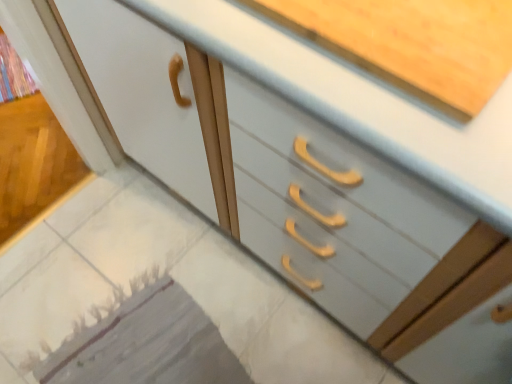
Question: Is white glossy countertop at upper center at the back of white glossy tile at lower left?

Choices:
 (A) yes
 (B) no

Answer: (B)

Question: Is white glossy countertop at upper center inside white glossy tile at lower left?

Choices:
 (A) yes
 (B) no

Answer: (B)

Question: Is white glossy tile at lower left aimed at white glossy countertop at upper center?

Choices:
 (A) no
 (B) yes

Answer: (A)

Question: From a real-world perspective, is white glossy tile at lower left under white glossy countertop at upper center?

Choices:
 (A) yes
 (B) no

Answer: (A)

Question: Is white glossy tile at lower left positioned behind white glossy countertop at upper center?

Choices:
 (A) yes
 (B) no

Answer: (A)

Question: Is white glossy tile at lower left located outside white glossy countertop at upper center?

Choices:
 (A) no
 (B) yes

Answer: (B)

Question: Does white glossy countertop at upper center turn towards white glossy tile at lower left?

Choices:
 (A) no
 (B) yes

Answer: (B)

Question: Does white glossy countertop at upper center appear on the left side of white glossy tile at lower left?

Choices:
 (A) no
 (B) yes

Answer: (A)

Question: From the image's perspective, is white glossy countertop at upper center on white glossy tile at lower left?

Choices:
 (A) yes
 (B) no

Answer: (A)

Question: From a real-world perspective, is white glossy countertop at upper center under white glossy tile at lower left?

Choices:
 (A) no
 (B) yes

Answer: (A)

Question: Can you confirm if white glossy countertop at upper center is bigger than white glossy tile at lower left?

Choices:
 (A) yes
 (B) no

Answer: (A)

Question: Is the surface of white glossy countertop at upper center in direct contact with white glossy tile at lower left?

Choices:
 (A) no
 (B) yes

Answer: (A)

Question: Is white glossy countertop at upper center wider or thinner than white glossy tile at lower left?

Choices:
 (A) wide
 (B) thin

Answer: (A)